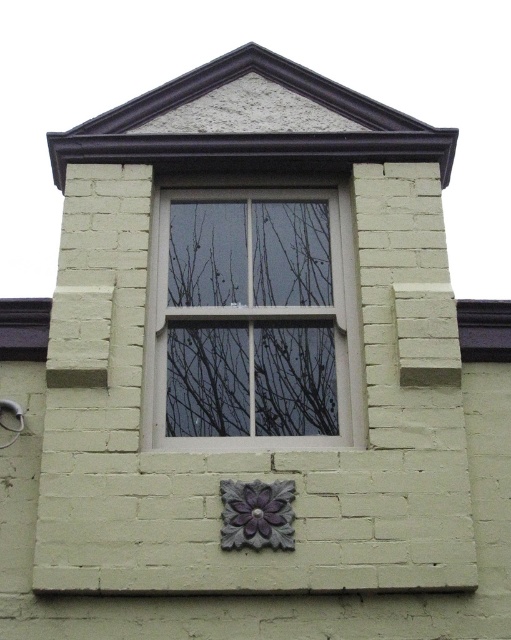
Question: Does white wood window at center have a smaller size compared to purple matte flower at lower center?

Choices:
 (A) no
 (B) yes

Answer: (A)

Question: Is white wood window at center to the left of purple matte flower at lower center from the viewer's perspective?

Choices:
 (A) no
 (B) yes

Answer: (B)

Question: Can you confirm if white wood window at center is positioned to the left of purple matte flower at lower center?

Choices:
 (A) yes
 (B) no

Answer: (A)